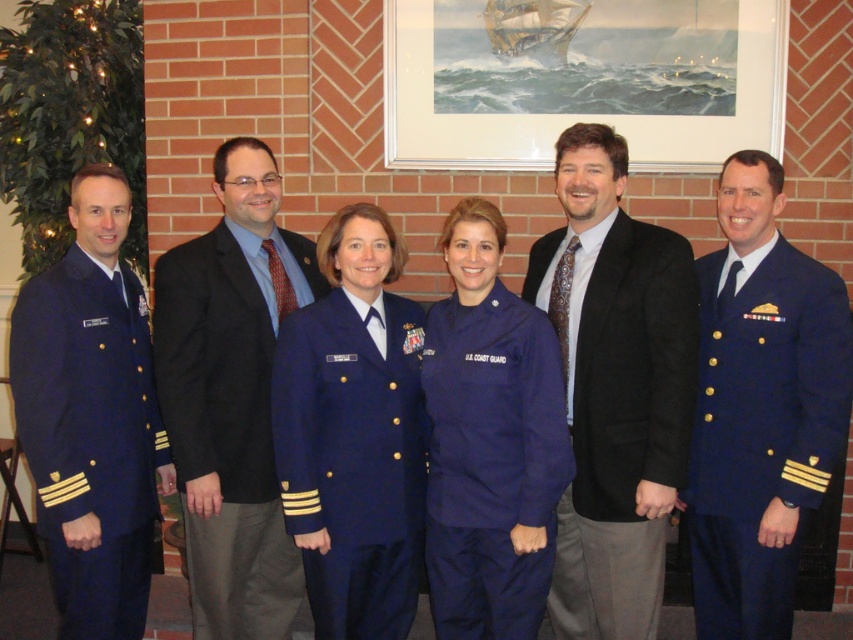
Question: Is dark brown suit at center thinner than navy blue woolen uniform at right?

Choices:
 (A) yes
 (B) no

Answer: (B)

Question: Can you confirm if matte black suit at center is smaller than navy blue woolen uniform at center?

Choices:
 (A) yes
 (B) no

Answer: (B)

Question: Where is matte black suit at center located in relation to navy blue woolen uniform at center in the image?

Choices:
 (A) right
 (B) left

Answer: (B)

Question: Which of the following is the closest to the observer?

Choices:
 (A) navy blue woolen jacket at left
 (B) dark brown suit at center
 (C) navy blue fabric us coast guard uniform at center
 (D) navy blue woolen uniform at center

Answer: (C)

Question: Which of these objects is positioned closest to the dark brown suit at center?

Choices:
 (A) navy blue woolen jacket at left
 (B) navy blue fabric us coast guard uniform at center
 (C) navy blue woolen uniform at right
 (D) matte black suit at center

Answer: (B)

Question: Which of the following is the farthest from the observer?

Choices:
 (A) (306, 435)
 (B) (264, 432)

Answer: (B)